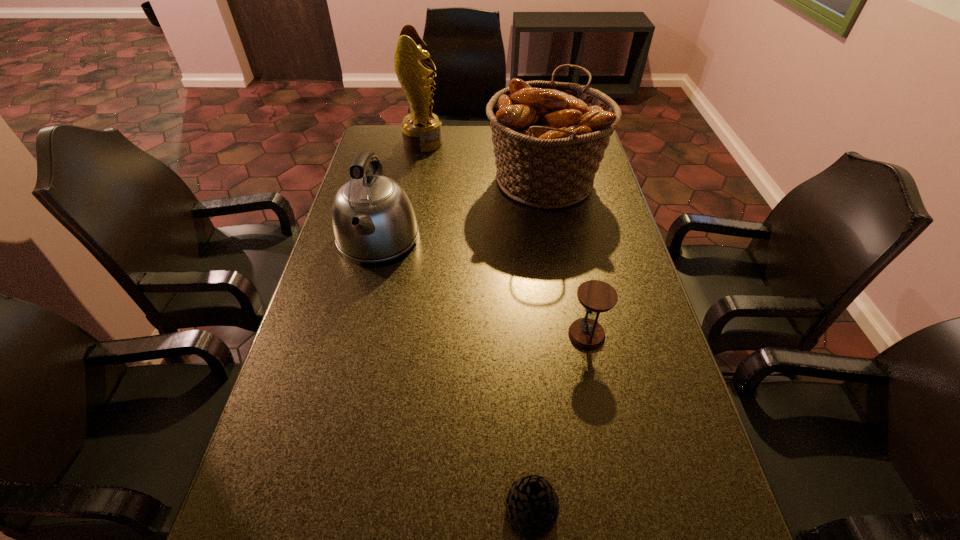
You are a GUI agent. You are given a task and a screenshot of the screen. Output one action in this format:
    pyautogui.click(x=<x>, y=<y>)
    Task: Click on the object identified as the closest to the pinecone
    Image resolution: width=960 pixels, height=540 pixels.
    Given the screenshot: What is the action you would take?
    pyautogui.click(x=595, y=296)

Find the location of a particular element. free location that satisfies the following two spatial constraints: 1. on the front-facing side of the award; 2. on the spout of the third shortest object is located at coordinates (406, 239).

This screenshot has width=960, height=540. I want to click on free space that satisfies the following two spatial constraints: 1. on the front-facing side of the award; 2. on the spout of the third tallest object, so click(x=406, y=239).

This screenshot has width=960, height=540. Find the location of `vacant space that satisfies the following two spatial constraints: 1. on the front-facing side of the award; 2. on the right side of the basket`. vacant space that satisfies the following two spatial constraints: 1. on the front-facing side of the award; 2. on the right side of the basket is located at coordinates (417, 181).